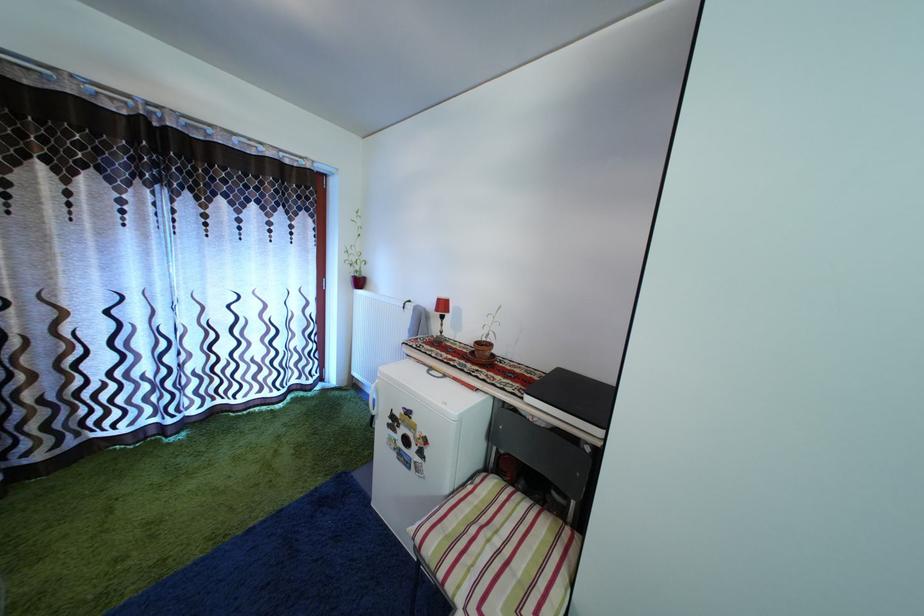
Find where to lift the terracotta plant pot. Please return your answer as a coordinate pair (x, y).

(482, 349)